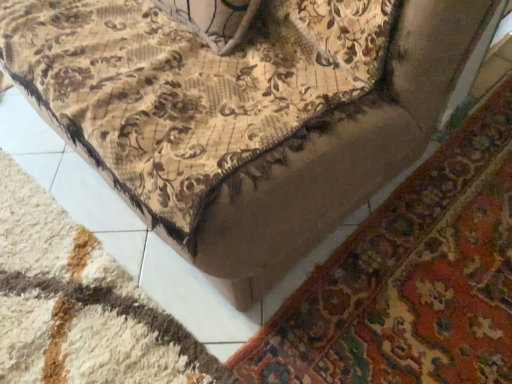
The image size is (512, 384). Find the location of `vacant area on top of floral fabric mat at lower right, which is the 2th mat from left to right (from a real-world perspective)`. vacant area on top of floral fabric mat at lower right, which is the 2th mat from left to right (from a real-world perspective) is located at coordinates (443, 249).